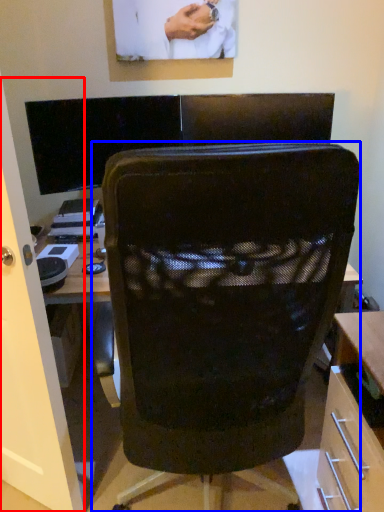
Question: Which of the following is the closest to the observer, glass door (highlighted by a red box) or chair (highlighted by a blue box)?

Choices:
 (A) glass door
 (B) chair

Answer: (B)